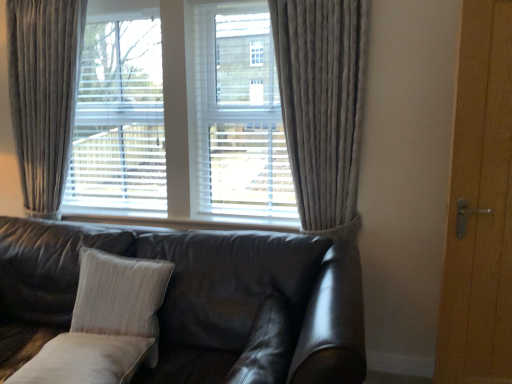
Question: In the image, is leather couch at center on the left side or the right side of velvet gray curtain at left, acting as the 2th curtain starting from the right?

Choices:
 (A) right
 (B) left

Answer: (A)

Question: From a real-world perspective, is leather couch at center physically located above or below velvet gray curtain at left, acting as the 2th curtain starting from the right?

Choices:
 (A) above
 (B) below

Answer: (B)

Question: Which object is positioned closest to the velvet gray curtain at left, acting as the 2th curtain starting from the right?

Choices:
 (A) gray textured curtain at center, which appears as the second curtain when viewed from the left
 (B) suede-like beige pillow at lower center, the 2th pillow in the left-to-right sequence
 (C) textured beige pillow at center, which appears as the 2th pillow when viewed from the right
 (D) leather couch at center
 (E) wooden door at right

Answer: (D)

Question: Based on their relative distances, which object is farther from the wooden door at right?

Choices:
 (A) gray textured curtain at center, which appears as the second curtain when viewed from the left
 (B) suede-like beige pillow at lower center, the second pillow from the back
 (C) leather couch at center
 (D) silky gray curtains at center
 (E) velvet gray curtain at left, acting as the 2th curtain starting from the right

Answer: (E)